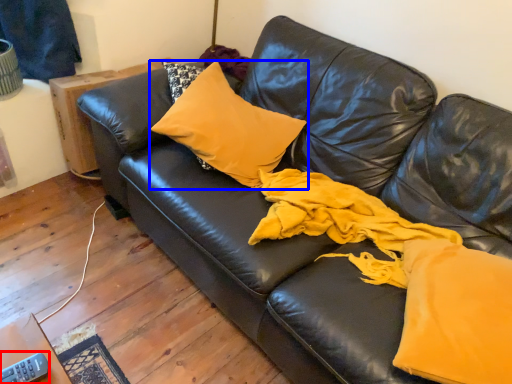
Question: Which object appears farthest to the camera in this image, remote (highlighted by a red box) or pillow (highlighted by a blue box)?

Choices:
 (A) remote
 (B) pillow

Answer: (B)